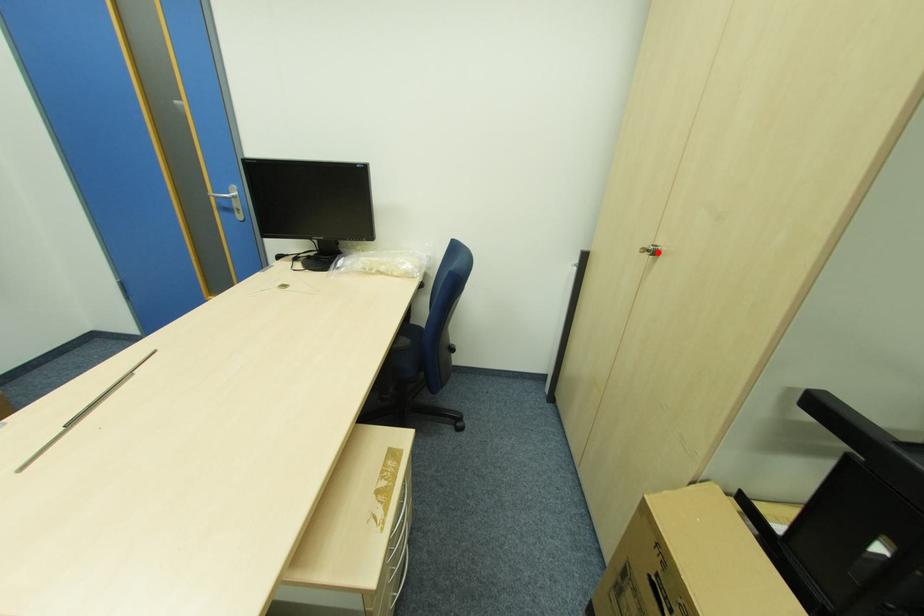
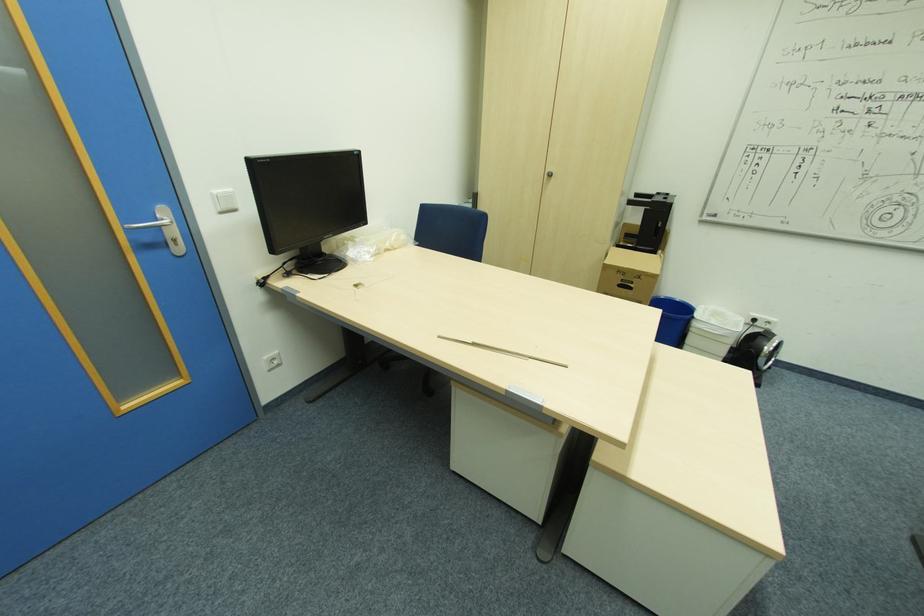
In the second image, find the point that corresponds to the highlighted location in the first image.

(553, 175)